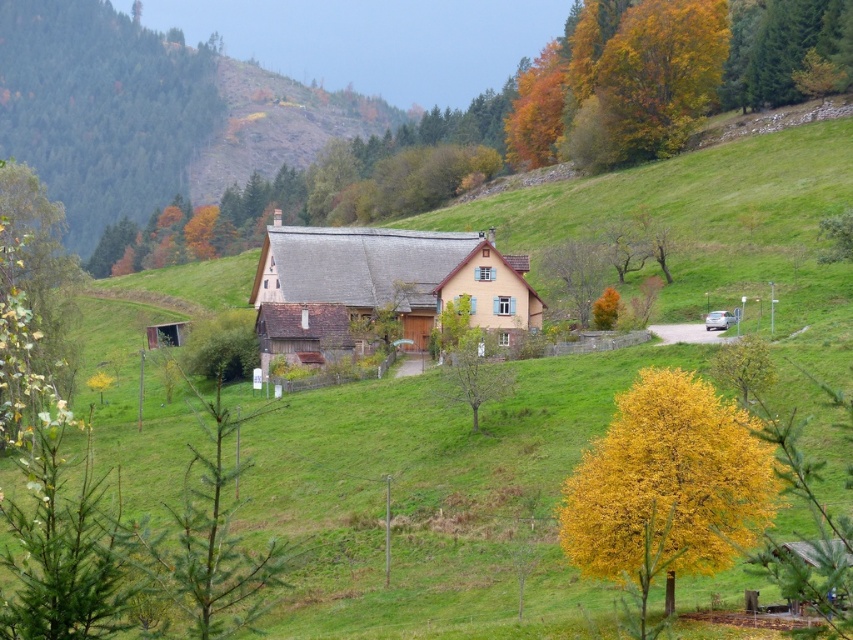
Between green needle-like at lower left and yellow leafy tree at right, which one is positioned higher?

Positioned higher is yellow leafy tree at right.

Looking at this image, how far apart are green needle-like at lower left and yellow leafy tree at right?

A distance of 79.91 feet exists between green needle-like at lower left and yellow leafy tree at right.

In the scene shown: Who is more forward, (189, 472) or (769, 364)?

Positioned in front is point (769, 364).

Find the location of `green needle-like at lower left`. green needle-like at lower left is located at coordinates point(213,541).

Is yellow leafy tree at lower right thinner than green matte tree at lower left?

Yes, yellow leafy tree at lower right is thinner than green matte tree at lower left.

Can you confirm if yellow leafy tree at lower right is bigger than green matte tree at lower left?

Actually, yellow leafy tree at lower right might be smaller than green matte tree at lower left.

Between point (637, 579) and point (38, 493), which one is positioned behind?

The point (637, 579) is behind.

This screenshot has width=853, height=640. What are the coordinates of `yellow leafy tree at lower right` in the screenshot? It's located at (668, 484).

The width and height of the screenshot is (853, 640). Describe the element at coordinates (660, 74) in the screenshot. I see `golden yellow leaves at upper right` at that location.

Which is in front, point (660, 4) or point (254, 620)?

Point (254, 620)

The image size is (853, 640). Find the location of `golden yellow leaves at upper right`. golden yellow leaves at upper right is located at coordinates (660, 74).